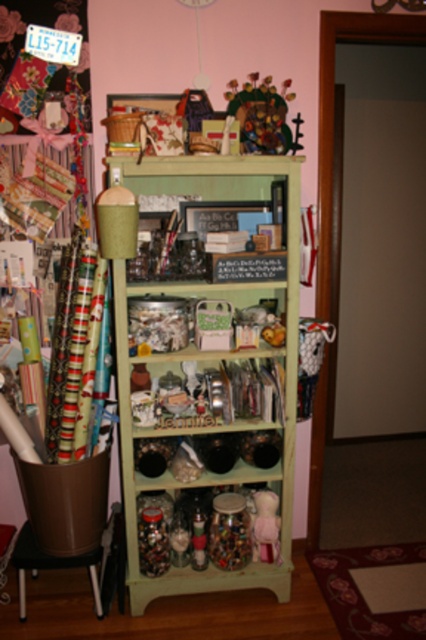
Is green painted wood bookshelf at center below brown plastic stool at lower left?

Actually, green painted wood bookshelf at center is above brown plastic stool at lower left.

Does green painted wood bookshelf at center appear over brown plastic stool at lower left?

Correct, green painted wood bookshelf at center is located above brown plastic stool at lower left.

Image resolution: width=426 pixels, height=640 pixels. What are the coordinates of `green painted wood bookshelf at center` in the screenshot? It's located at (210, 380).